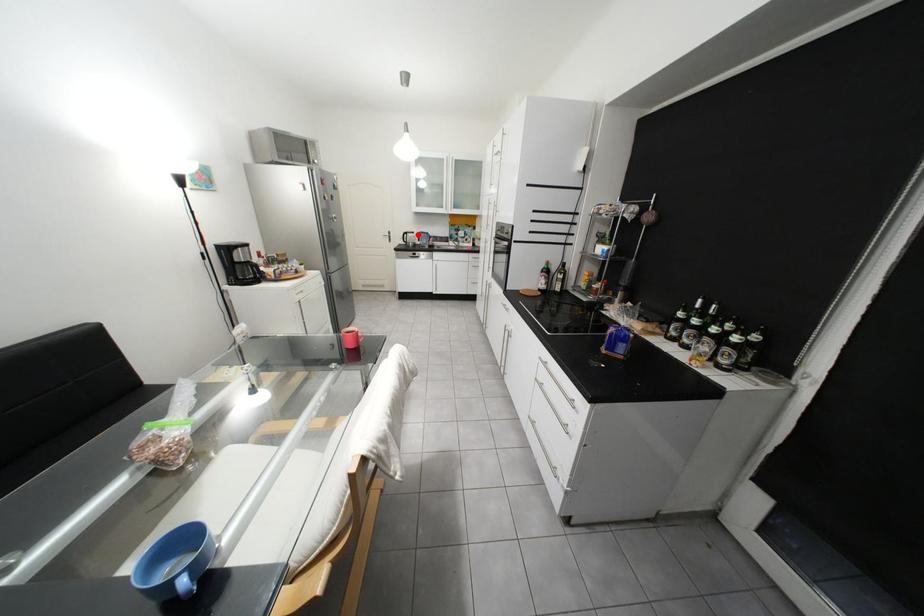
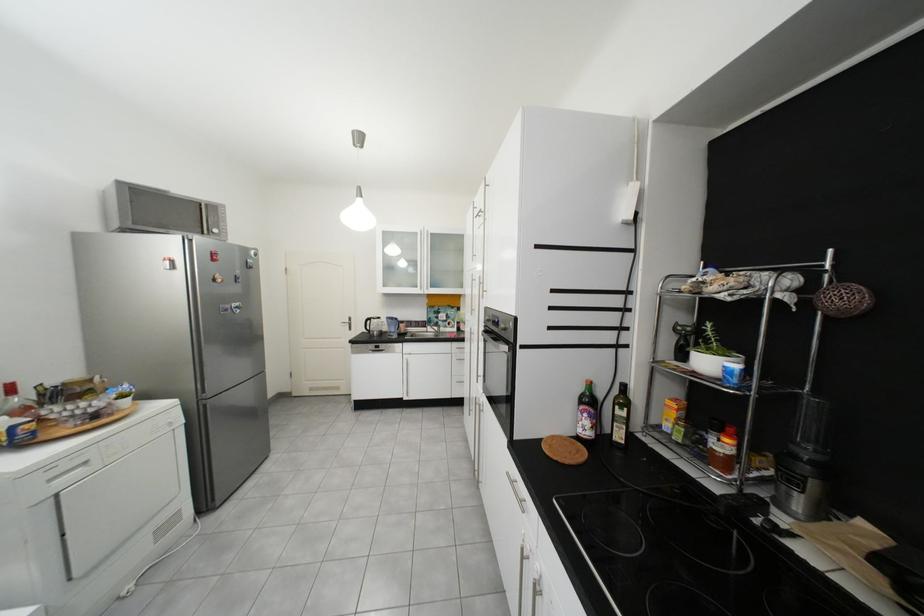
Question: I am providing you with two images of the same scene from different viewpoints. In image1, a red point is highlighted. Considering the same 3D point in image2, which of the following is correct?

Choices:
 (A) It is closer
 (B) It is farther

Answer: (B)